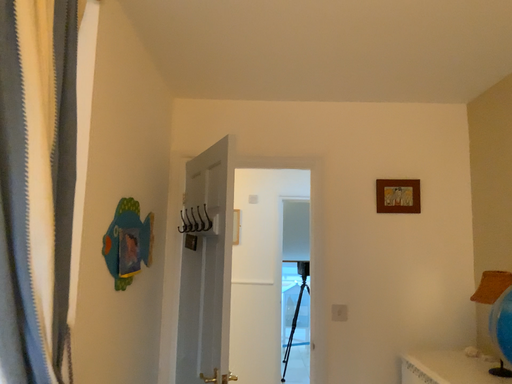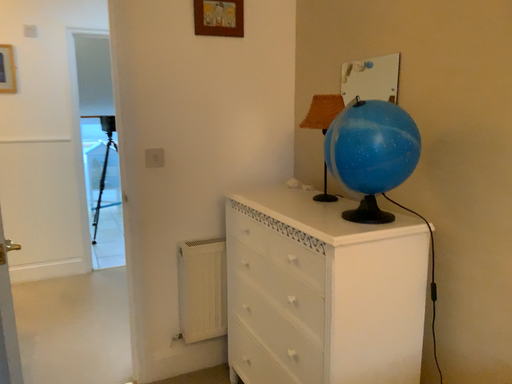
Question: How did the camera likely rotate when shooting the video?

Choices:
 (A) rotated left
 (B) rotated right

Answer: (B)